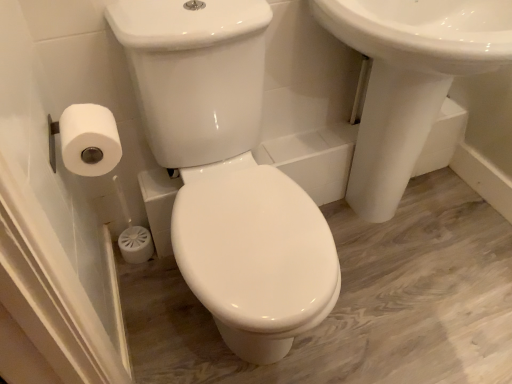
You are a GUI agent. You are given a task and a screenshot of the screen. Output one action in this format:
    pyautogui.click(x=<x>, y=<y>)
    Task: Click on the empty space that is to the right of white glossy toilet at center
    Image resolution: width=512 pixels, height=384 pixels.
    Given the screenshot: What is the action you would take?
    pyautogui.click(x=419, y=327)